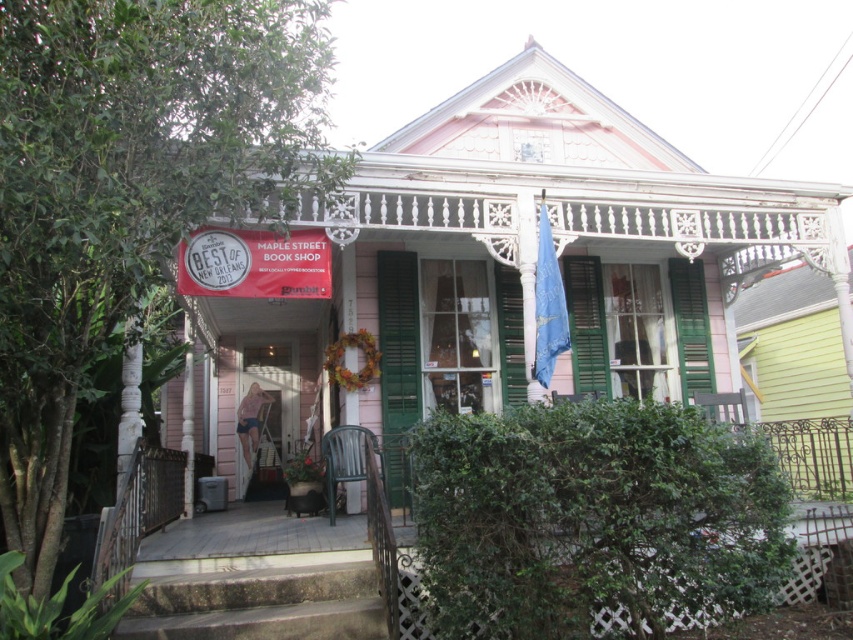
Locate an element on the screen. The width and height of the screenshot is (853, 640). green plastic chair at lower center is located at coordinates (256, 580).

Is green plastic chair at lower center bigger than green matte shutter at center?

Correct, green plastic chair at lower center is larger in size than green matte shutter at center.

Is point (155, 620) behind point (408, 300)?

No, it is in front of (408, 300).

Find the location of a particular element. This screenshot has height=640, width=853. green plastic chair at lower center is located at coordinates (256, 580).